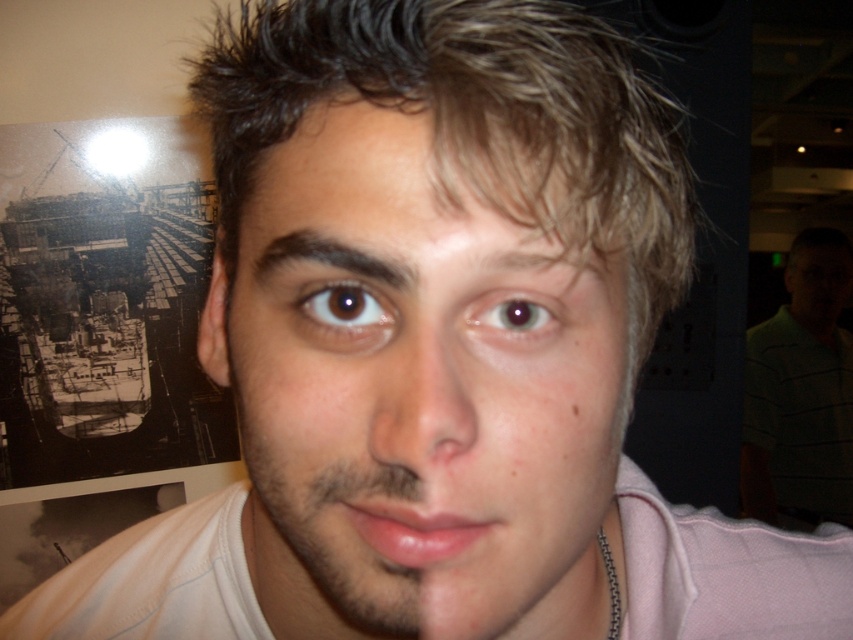
Is smooth skin face at center bigger than green striped shirt at right?

No.

Who is positioned more to the right, smooth skin face at center or green striped shirt at right?

green striped shirt at right

Describe the element at coordinates (415, 400) in the screenshot. I see `smooth skin face at center` at that location.

Find the location of a particular element. Image resolution: width=853 pixels, height=640 pixels. smooth skin face at center is located at coordinates (415, 400).

Does smooth skin face at center have a lesser width compared to smooth skin nose at center?

No.

Which is in front, point (364, 632) or point (407, 413)?

Positioned in front is point (407, 413).

What do you see at coordinates (415, 400) in the screenshot?
I see `smooth skin face at center` at bounding box center [415, 400].

Locate an element on the screen. The image size is (853, 640). smooth skin face at center is located at coordinates (415, 400).

Is brown shiny eye at center shorter than brown glossy eye at center?

Correct, brown shiny eye at center is not as tall as brown glossy eye at center.

Which is more to the right, brown shiny eye at center or brown glossy eye at center?

brown glossy eye at center is more to the right.

Which is behind, point (338, 316) or point (532, 330)?

Positioned behind is point (338, 316).

Locate an element on the screen. This screenshot has height=640, width=853. brown shiny eye at center is located at coordinates (345, 307).